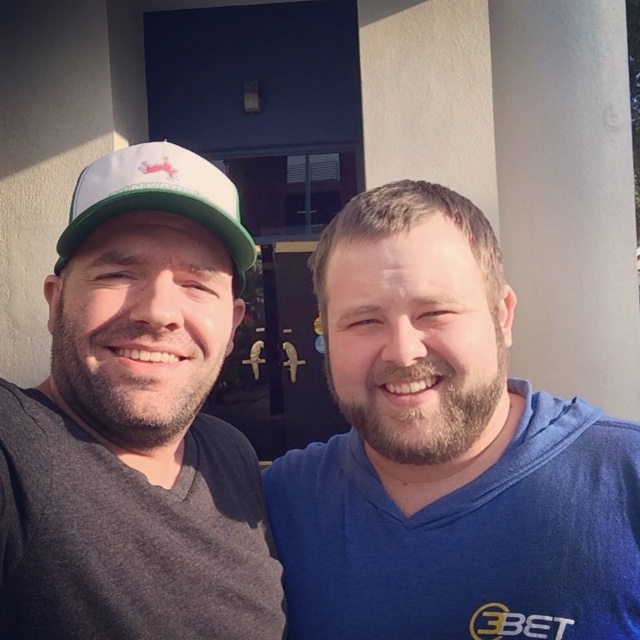
Can you confirm if gray matte cap at left is shorter than white fabric baseball cap at left?

Incorrect, gray matte cap at left's height does not fall short of white fabric baseball cap at left's.

Between gray matte cap at left and white fabric baseball cap at left, which one has less height?

Standing shorter between the two is white fabric baseball cap at left.

Which is in front, point (108, 545) or point (74, 196)?

Positioned in front is point (108, 545).

Identify the location of gray matte cap at left. pyautogui.click(x=136, y=422).

In the scene shown: Which is above, blue cotton shirt at center or gray matte cap at left?

gray matte cap at left

Which is in front, point (412, 221) or point (253, 586)?

Point (412, 221)

Where is `blue cotton shirt at center`? This screenshot has height=640, width=640. blue cotton shirt at center is located at coordinates (445, 452).

This screenshot has height=640, width=640. Find the location of `blue cotton shirt at center`. blue cotton shirt at center is located at coordinates (445, 452).

Can you confirm if blue cotton shirt at center is thinner than white fabric baseball cap at left?

No.

Between point (328, 440) and point (84, 193), which one is positioned in front?

Point (84, 193) is more forward.

What do you see at coordinates (445, 452) in the screenshot? This screenshot has width=640, height=640. I see `blue cotton shirt at center` at bounding box center [445, 452].

You are a GUI agent. You are given a task and a screenshot of the screen. Output one action in this format:
    pyautogui.click(x=<x>, y=<y>)
    Task: Click on the blue cotton shirt at center
    
    Given the screenshot: What is the action you would take?
    pyautogui.click(x=445, y=452)